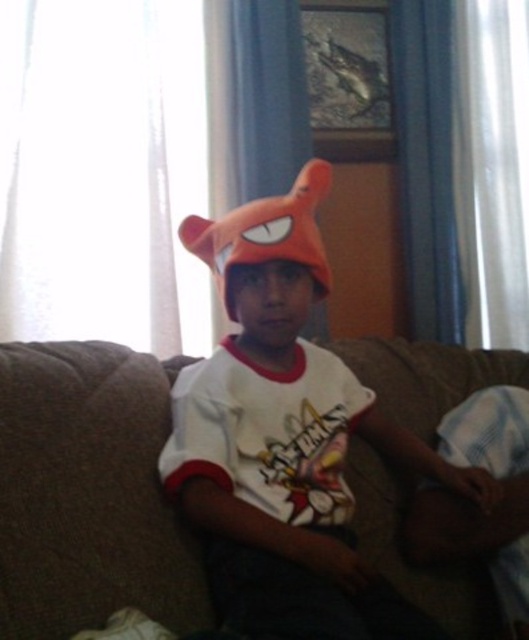
Question: Which point is closer to the camera?

Choices:
 (A) (238, 230)
 (B) (471, 620)

Answer: (A)

Question: Does matte orange hat at center lie behind orange plush hat at center?

Choices:
 (A) yes
 (B) no

Answer: (B)

Question: Which point is closer to the camera?

Choices:
 (A) (141, 428)
 (B) (404, 458)
 (C) (276, 244)

Answer: (C)

Question: Considering the real-world distances, which object is closest to the orange plush hat at center?

Choices:
 (A) brown fabric couch at center
 (B) matte orange hat at center

Answer: (B)

Question: From the image, what is the correct spatial relationship of brown fabric couch at center in relation to matte orange hat at center?

Choices:
 (A) left
 (B) right

Answer: (A)

Question: Is matte orange hat at center above white fabric at lower right?

Choices:
 (A) yes
 (B) no

Answer: (A)